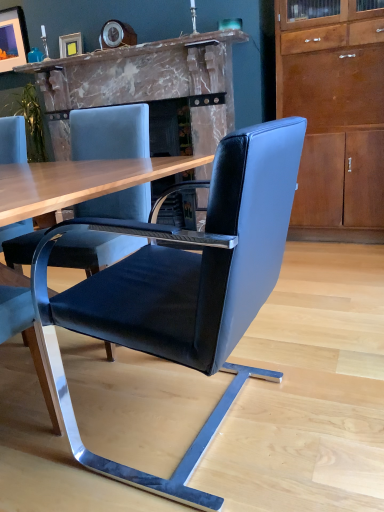
Question: In terms of width, does black leather chair at center look wider or thinner when compared to marble fireplace at center?

Choices:
 (A) thin
 (B) wide

Answer: (A)

Question: From a real-world perspective, is black leather chair at center positioned above or below marble fireplace at center?

Choices:
 (A) above
 (B) below

Answer: (B)

Question: Which is nearer to the marble fireplace at center?

Choices:
 (A) black leather chair at center
 (B) matte black picture frame at upper left, which ranks as the 1th picture frame in left-to-right order
 (C) teal glass at upper center
 (D) matte gold picture frame at upper center, marked as the first picture frame in a front-to-back arrangement
 (E) matte brown cabinet at right

Answer: (D)

Question: Considering the real-world distances, which object is closest to the matte brown cabinet at right?

Choices:
 (A) black leather chair at center
 (B) teal glass at upper center
 (C) matte black picture frame at upper left, the 2th picture frame when ordered from right to left
 (D) marble fireplace at center
 (E) matte gold picture frame at upper center, which is the 2th picture frame in top-to-bottom order

Answer: (D)